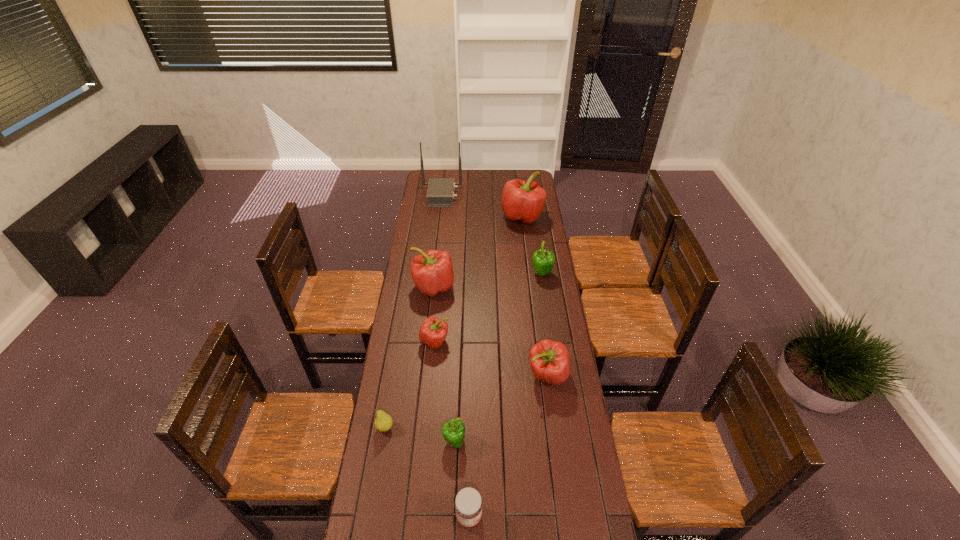
Locate an element on the screen. The width and height of the screenshot is (960, 540). vacant position at the right edge of the desktop is located at coordinates (522, 252).

The height and width of the screenshot is (540, 960). What are the coordinates of `vacant space at the far right corner of the desktop` in the screenshot? It's located at (539, 179).

Identify the location of vacant space that's between the third nearest pink bell pepper and the bigger green bell pepper. (488, 280).

Locate an element on the screen. This screenshot has height=540, width=960. free area in between the farthest bell pepper and the nearest object is located at coordinates (495, 366).

Identify the location of vacant region between the third smallest pink bell pepper and the tallest bell pepper. (478, 252).

The image size is (960, 540). Find the location of `vacant space in between the smaller green bell pepper and the farthest bell pepper`. vacant space in between the smaller green bell pepper and the farthest bell pepper is located at coordinates (489, 329).

The width and height of the screenshot is (960, 540). Find the location of `free spot between the smaller green bell pepper and the right green bell pepper`. free spot between the smaller green bell pepper and the right green bell pepper is located at coordinates (498, 357).

Where is `unoccupied area between the second smallest pink bell pepper and the tallest object`? Image resolution: width=960 pixels, height=540 pixels. unoccupied area between the second smallest pink bell pepper and the tallest object is located at coordinates (494, 285).

Find the location of a particular element. This screenshot has height=540, width=960. vacant area that lies between the tallest object and the farther green bell pepper is located at coordinates (492, 234).

This screenshot has width=960, height=540. I want to click on vacant area between the tallest object and the second smallest pink bell pepper, so click(x=494, y=285).